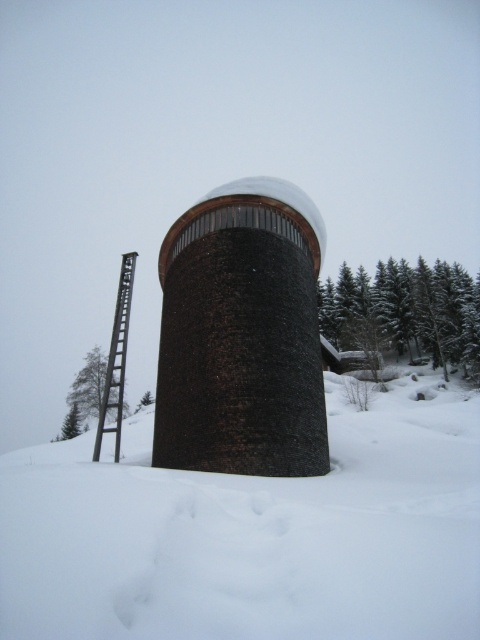
You are an explorer trying to determine the best path to reach the top of the brown textured tower at center. You notice the white powdery snow at lower center. Considering their sizes, which object would you prioritize stepping on to avoid sinking?

The brown textured tower at center has a smaller size compared to the white powdery snow at lower center. Since the tower is smaller, stepping on it might be unstable. Therefore, you should prioritize stepping on the white powdery snow at lower center, which is larger and more stable underfoot.

You are standing in front of the snowy cylindrical structure and notice two trees in the background. Which tree, the green textured trees at right or the green matte tree at left, is closer to you?

The green textured trees at right is closer to you because it is in front of the green matte tree at left.

You are standing in the snowy landscape and want to determine which object is taller between the white powdery snow at lower center and the brown textured tower at center. Based on the scene, which one is taller?

The brown textured tower at center is taller than the white powdery snow at lower center.